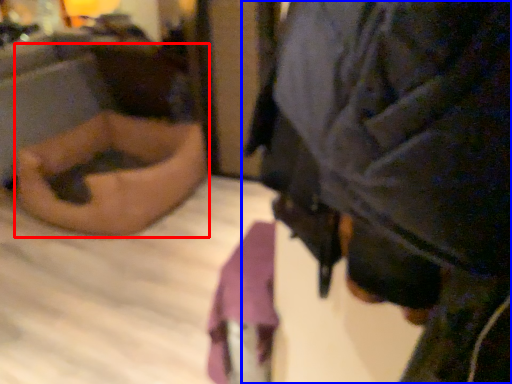
Question: Which object appears closest to the camera in this image, person (highlighted by a red box) or person (highlighted by a blue box)?

Choices:
 (A) person
 (B) person

Answer: (B)